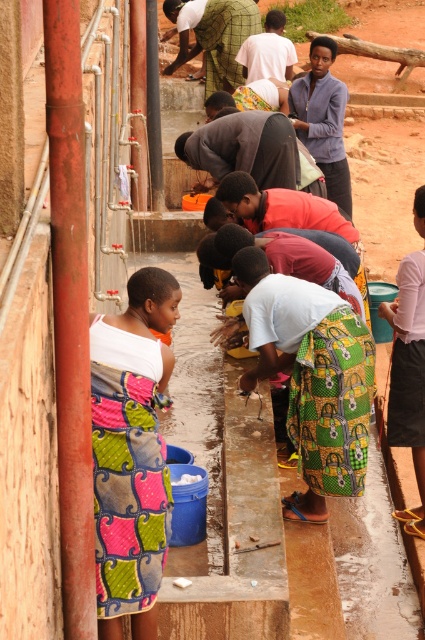
You are standing at the communal washing area and want to take a photo of the two points mentioned. Which point, point (x=394, y=332) or point (x=249, y=6), will appear larger in your camera view?

Point (x=394, y=332) is closer to the camera than point (x=249, y=6), so it will appear larger in the camera view.

You are organizing a community event and need to know the sizes of the items in the scene. Which object is larger between the pink fabric skirt at lower right and the green woven cloth at center?

The green woven cloth at center is larger than the pink fabric skirt at lower right.